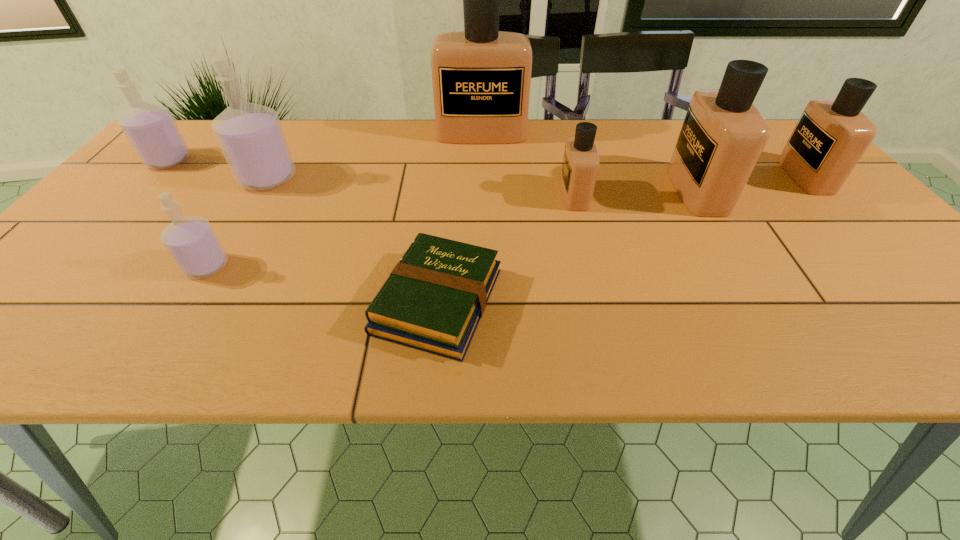
You are a GUI agent. You are given a task and a screenshot of the screen. Output one action in this format:
    pyautogui.click(x=<x>, y=<y>)
    Task: Click on the blank area located on the front of the leftmost object
    This screenshot has height=540, width=960.
    Given the screenshot: What is the action you would take?
    pyautogui.click(x=65, y=273)

You are a GUI agent. You are given a task and a screenshot of the screen. Output one action in this format:
    pyautogui.click(x=<x>, y=<y>)
    Task: Click on the vacant space located 0.170m on the front label of the rightmost object
    The height and width of the screenshot is (540, 960).
    Given the screenshot: What is the action you would take?
    pyautogui.click(x=723, y=176)

In order to click on free region located 0.080m on the front label of the rightmost object in this screenshot , I will do `click(757, 176)`.

You are a GUI agent. You are given a task and a screenshot of the screen. Output one action in this format:
    pyautogui.click(x=<x>, y=<y>)
    Task: Click on the free region located 0.160m on the front label of the rightmost object
    
    Given the screenshot: What is the action you would take?
    pyautogui.click(x=727, y=176)

Identify the location of vacant space located on the front label of the third perfume from right to left. The width and height of the screenshot is (960, 540). (512, 195).

Identify the location of free space located 0.260m on the front label of the third perfume from right to left. The height and width of the screenshot is (540, 960). (455, 195).

Where is `vacant region located 0.320m on the front label of the third perfume from right to left`? vacant region located 0.320m on the front label of the third perfume from right to left is located at coordinates (431, 195).

The image size is (960, 540). In order to click on free space located on the left of the smallest purple perfume in this screenshot , I will do `click(108, 266)`.

Locate an element on the screen. Image resolution: width=960 pixels, height=540 pixels. vacant space situated on the back of the book is located at coordinates (450, 159).

The height and width of the screenshot is (540, 960). Find the location of `object that is at the near edge`. object that is at the near edge is located at coordinates (434, 298).